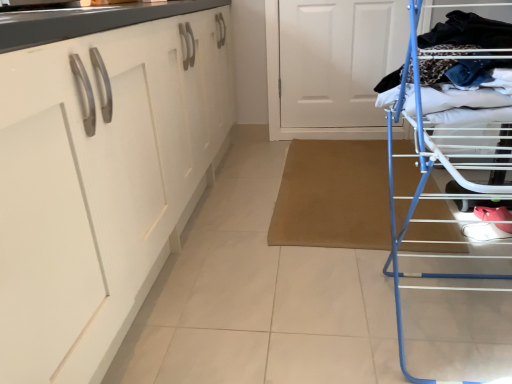
Where is `vacant space underneath blue metal drying rack at right (from a real-world perspective)`? vacant space underneath blue metal drying rack at right (from a real-world perspective) is located at coordinates (459, 326).